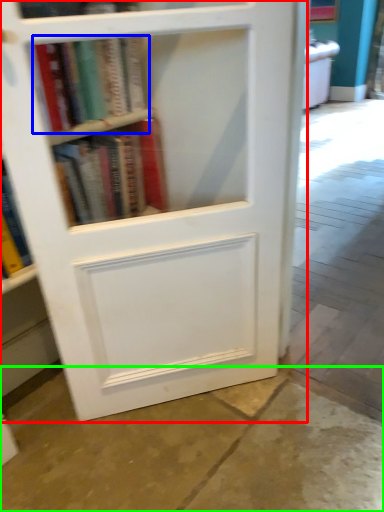
Question: Which is nearer to the bookcase (highlighted by a red box)? book (highlighted by a blue box) or concrete (highlighted by a green box).

Choices:
 (A) book
 (B) concrete

Answer: (A)